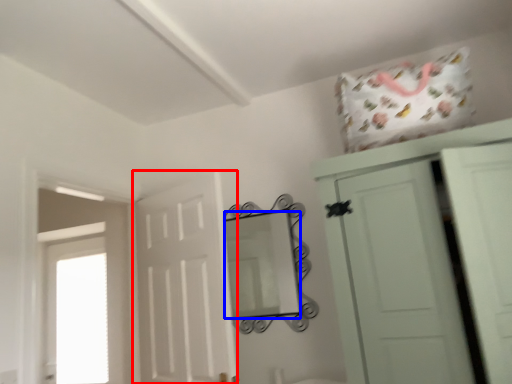
Question: Among these objects, which one is nearest to the camera, door (highlighted by a red box) or mirror (highlighted by a blue box)?

Choices:
 (A) door
 (B) mirror

Answer: (A)